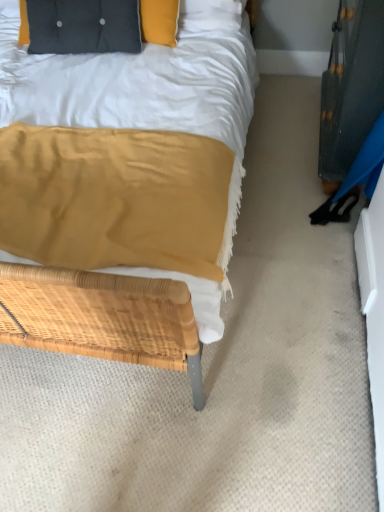
Question: Looking at the image, does black tufted pillow at upper left seem bigger or smaller compared to black glossy dresser at right?

Choices:
 (A) small
 (B) big

Answer: (B)

Question: From the image's perspective, is black tufted pillow at upper left above or below black glossy dresser at right?

Choices:
 (A) above
 (B) below

Answer: (A)

Question: In the image, is black tufted pillow at upper left on the left side or the right side of black glossy dresser at right?

Choices:
 (A) right
 (B) left

Answer: (B)

Question: Relative to black tufted pillow at upper left, is black glossy dresser at right in front or behind?

Choices:
 (A) front
 (B) behind

Answer: (A)

Question: From the image's perspective, is black glossy dresser at right positioned above or below black tufted pillow at upper left?

Choices:
 (A) above
 (B) below

Answer: (B)

Question: Would you say black glossy dresser at right is to the left or to the right of black tufted pillow at upper left in the picture?

Choices:
 (A) left
 (B) right

Answer: (B)

Question: Looking at their shapes, would you say black glossy dresser at right is wider or thinner than black tufted pillow at upper left?

Choices:
 (A) wide
 (B) thin

Answer: (B)